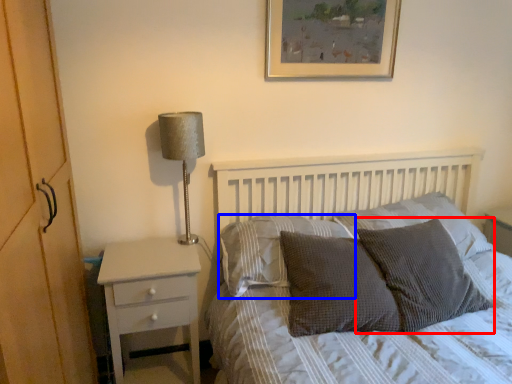
Question: Which object is closer to the camera taking this photo, pillow (highlighted by a red box) or pillow (highlighted by a blue box)?

Choices:
 (A) pillow
 (B) pillow

Answer: (A)